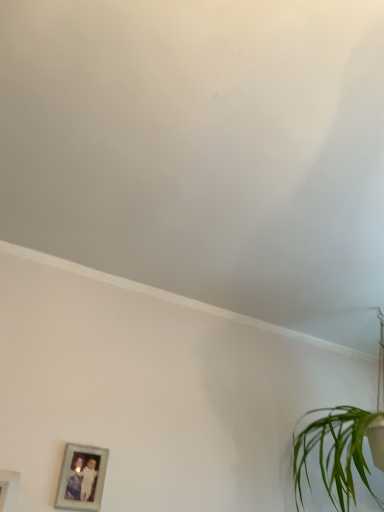
Question: Is silver metallic photo frame at lower left, the 2th picture frame in the left-to-right sequence, inside the boundaries of green leafy plant at lower right, or outside?

Choices:
 (A) inside
 (B) outside

Answer: (B)

Question: Is silver metallic photo frame at lower left, arranged as the 1th picture frame when viewed from the right, bigger or smaller than green leafy plant at lower right?

Choices:
 (A) big
 (B) small

Answer: (B)

Question: Which of these objects is positioned closest to the green leafy plant at lower right?

Choices:
 (A) white matte picture frame at lower left, the 1th picture frame from the left
 (B) white matte wall at upper center
 (C) silver metallic photo frame at lower left, the first picture frame in the back-to-front sequence

Answer: (C)

Question: Estimate the real-world distances between objects in this image. Which object is farther from the silver metallic photo frame at lower left, the second picture frame from the front?

Choices:
 (A) white matte picture frame at lower left, the 2th picture frame viewed from the back
 (B) green leafy plant at lower right
 (C) white matte wall at upper center

Answer: (C)